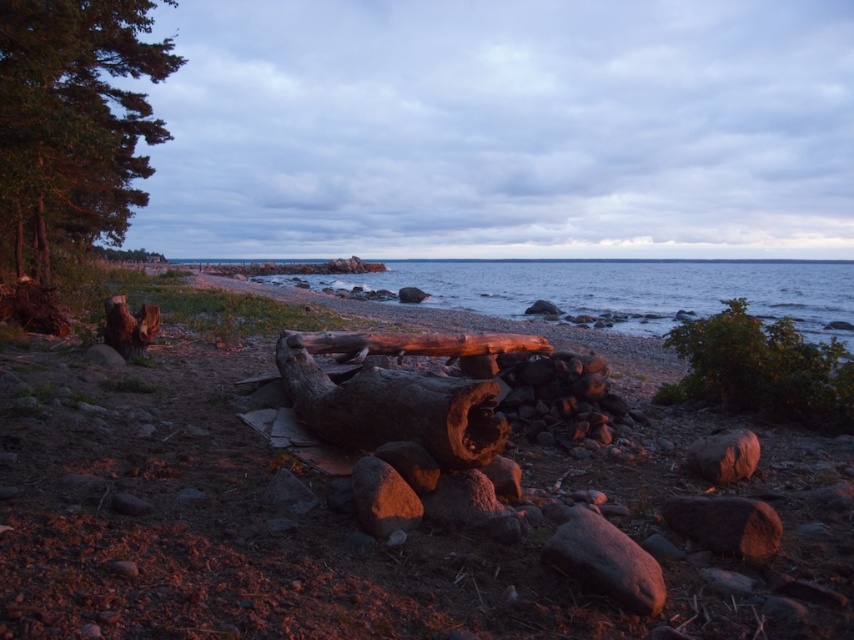
Between green leafy tree at upper left and rough wooden log at center, which one appears on the right side from the viewer's perspective?

Positioned to the right is rough wooden log at center.

Can you confirm if green leafy tree at upper left is positioned to the right of rough wooden log at center?

In fact, green leafy tree at upper left is to the left of rough wooden log at center.

Who is more forward, [106,138] or [357,448]?

Positioned in front is point [357,448].

This screenshot has width=854, height=640. What are the coordinates of `green leafy tree at upper left` in the screenshot? It's located at (72, 122).

Is smooth brown log at center to the left of rough wooden log at center from the viewer's perspective?

No, smooth brown log at center is not to the left of rough wooden log at center.

Is smooth brown log at center closer to camera compared to rough wooden log at center?

Yes, it is.

Consider the image. Who is more forward, (536, 499) or (370, 444)?

Point (536, 499) is in front.

Identify the location of smooth brown log at center. The image size is (854, 640). (372, 529).

Between green leafy tree at upper left and green leafy bush at right, which one appears on the left side from the viewer's perspective?

green leafy tree at upper left

Measure the distance from green leafy tree at upper left to green leafy bush at right.

25.93 meters

Who is more distant from viewer, [39,58] or [788,410]?

Positioned behind is point [39,58].

Locate an element on the screen. Image resolution: width=854 pixels, height=640 pixels. green leafy tree at upper left is located at coordinates (72, 122).